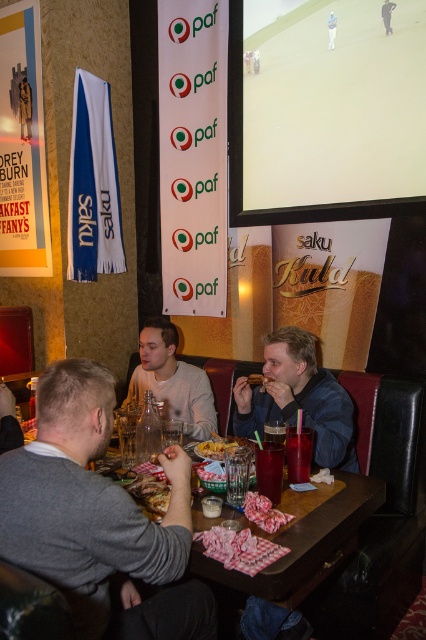
Question: Which object appears closest to the camera in this image?

Choices:
 (A) dark blue jacket at center
 (B) translucent glass at table center

Answer: (B)

Question: Can you confirm if light gray sweater at center is positioned below golden crispy fries at center?

Choices:
 (A) yes
 (B) no

Answer: (B)

Question: Does gray sweater at center appear over dark blue jacket at center?

Choices:
 (A) no
 (B) yes

Answer: (A)

Question: Which object appears closest to the camera in this image?

Choices:
 (A) translucent glass at table center
 (B) light gray sweater at center
 (C) gray sweater at center
 (D) dark blue jacket at center

Answer: (C)

Question: Is dark blue jacket at center to the left of translucent plastic cup at table center from the viewer's perspective?

Choices:
 (A) no
 (B) yes

Answer: (A)

Question: Among these points, which one is nearest to the camera?

Choices:
 (A) (262, 374)
 (B) (319, 465)
 (C) (264, 444)
 (D) (69, 461)

Answer: (D)